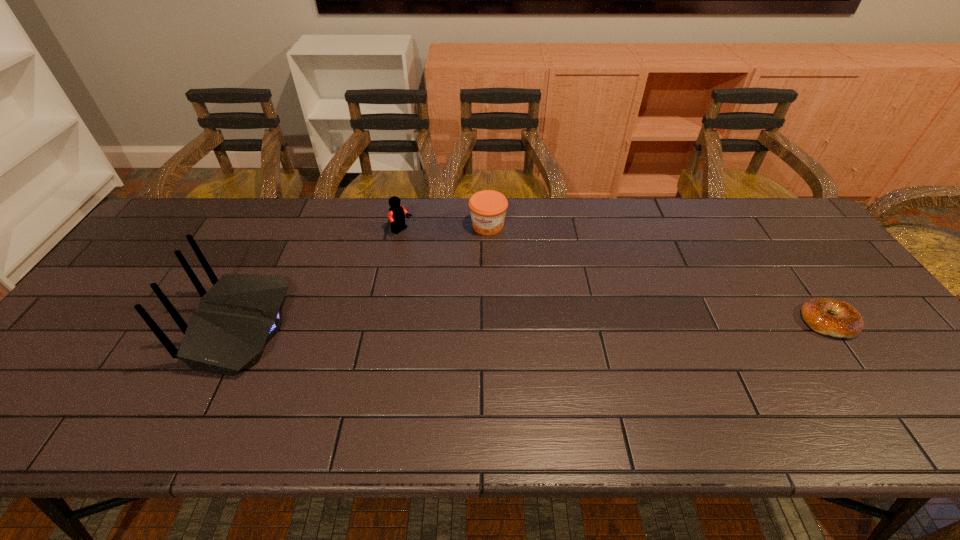
Where is `free space on the desktop that is between the leftmost object and the rightmost object and is positioned on the front label of the third object from left to right`? The width and height of the screenshot is (960, 540). free space on the desktop that is between the leftmost object and the rightmost object and is positioned on the front label of the third object from left to right is located at coordinates (450, 325).

You are a GUI agent. You are given a task and a screenshot of the screen. Output one action in this format:
    pyautogui.click(x=<x>, y=<y>)
    Task: Click on the vacant space on the desktop that is between the router and the bagel and is positioned on the front-facing side of the third object from right to left
    The height and width of the screenshot is (540, 960).
    Given the screenshot: What is the action you would take?
    pyautogui.click(x=528, y=324)